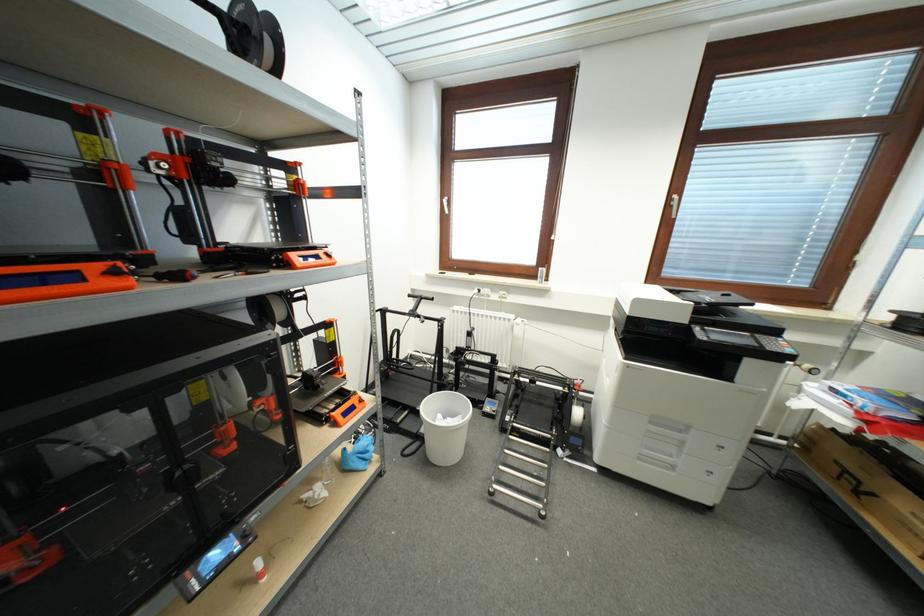
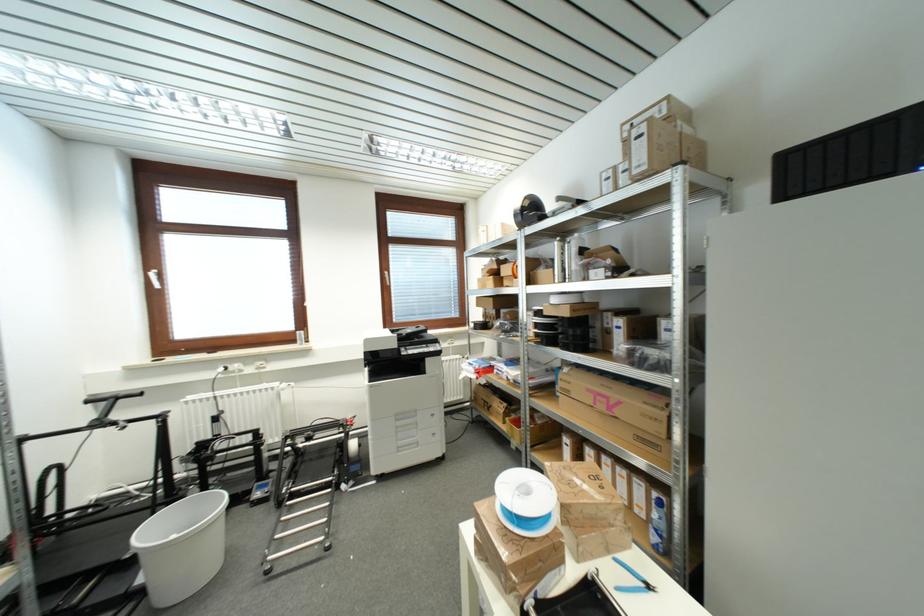
Locate, in the second image, the point that corresponds to point (446, 200) in the first image.

(151, 273)